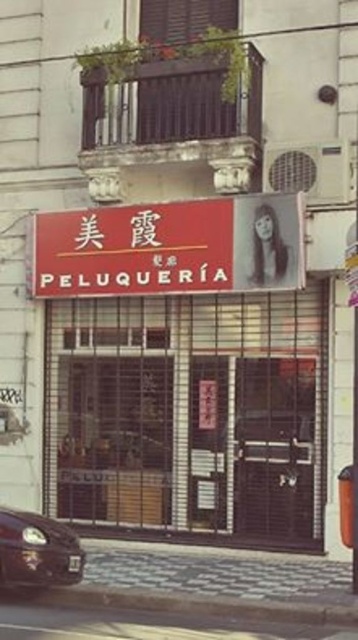
Does matte red sign at center appear on the right side of shiny black car at lower left?

Correct, you'll find matte red sign at center to the right of shiny black car at lower left.

Does matte red sign at center lie in front of shiny black car at lower left?

No, matte red sign at center is behind shiny black car at lower left.

Is point (94, 284) farther from camera compared to point (6, 508)?

Yes, point (94, 284) is behind point (6, 508).

In order to click on matte red sign at center in this screenshot , I will do `click(171, 248)`.

Is gray concrete curb at lower center above shiny black car at lower left?

No.

Is point (153, 598) closer to camera compared to point (0, 509)?

Yes, point (153, 598) is closer to viewer.

You are a GUI agent. You are given a task and a screenshot of the screen. Output one action in this format:
    pyautogui.click(x=<x>, y=<y>)
    Task: Click on the gray concrete curb at lower center
    The height and width of the screenshot is (640, 358).
    Given the screenshot: What is the action you would take?
    pyautogui.click(x=187, y=605)

Is matte red sign at center shorter than gray concrete curb at lower center?

In fact, matte red sign at center may be taller than gray concrete curb at lower center.

Who is more forward, (229,218) or (204,621)?

Point (204,621) is in front.

This screenshot has height=640, width=358. What do you see at coordinates (171, 248) in the screenshot?
I see `matte red sign at center` at bounding box center [171, 248].

Where is `matte red sign at center`? This screenshot has height=640, width=358. matte red sign at center is located at coordinates (171, 248).